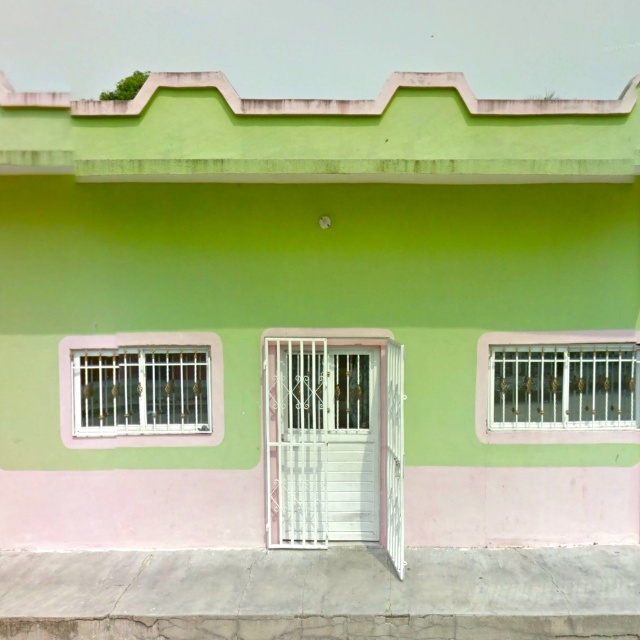
Is the position of white metal window at left more distant than that of white metal window at right?

Yes, it is behind white metal window at right.

What do you see at coordinates (140, 344) in the screenshot? I see `white metal window at left` at bounding box center [140, 344].

This screenshot has height=640, width=640. What are the coordinates of `white metal window at left` in the screenshot? It's located at (140, 344).